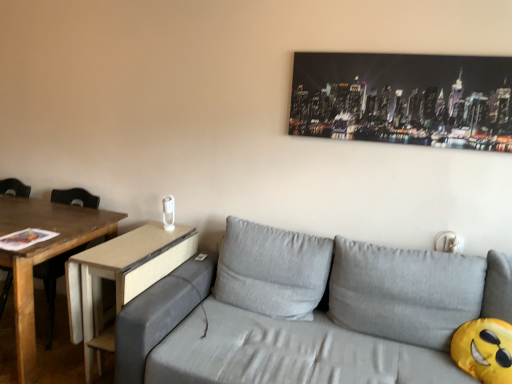
Question: Is wooden chair at left inside or outside of gray fabric couch at center?

Choices:
 (A) inside
 (B) outside

Answer: (B)

Question: Is wooden chair at left in front of or behind gray fabric couch at center in the image?

Choices:
 (A) behind
 (B) front

Answer: (A)

Question: Estimate the real-world distances between objects in this image. Which object is closer to the light brown wood side table at center-left?

Choices:
 (A) gray fabric couch at center
 (B) wooden chair at left
 (C) metallic cityscape print at upper right

Answer: (B)

Question: Which object is positioned farthest from the wooden chair at left?

Choices:
 (A) gray fabric couch at center
 (B) light brown wood side table at center-left
 (C) metallic cityscape print at upper right

Answer: (C)